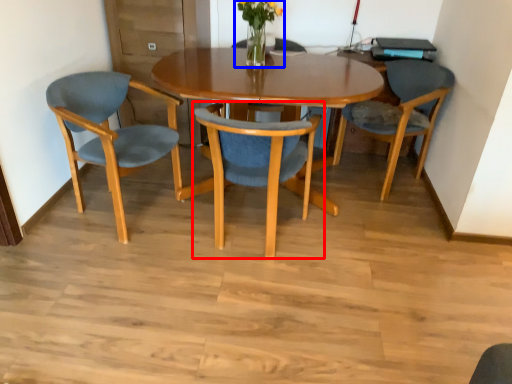
Question: Which point is closer to the camera, chair (highlighted by a red box) or floral arrangement (highlighted by a blue box)?

Choices:
 (A) chair
 (B) floral arrangement

Answer: (A)